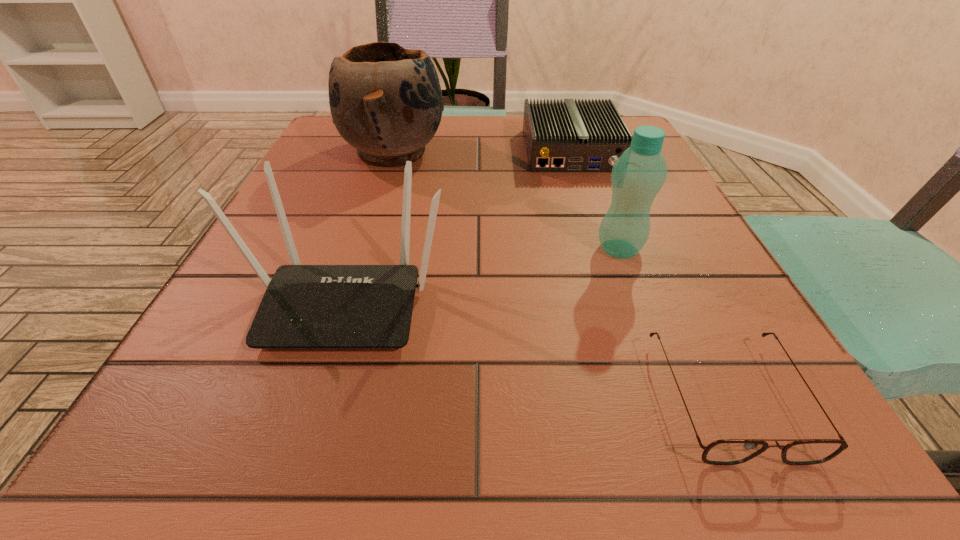
This screenshot has width=960, height=540. In order to click on vacant space located 0.280m on the back panel of the farther router in this screenshot , I will do `click(610, 265)`.

This screenshot has height=540, width=960. What are the coordinates of `pottery that is at the far edge` in the screenshot? It's located at (386, 101).

Find the location of `router present at the far edge`. router present at the far edge is located at coordinates (568, 136).

The height and width of the screenshot is (540, 960). I want to click on object that is at the near edge, so click(725, 451).

Identify the location of pottery that is at the left edge. This screenshot has height=540, width=960. (386, 101).

Where is `router situated at the left edge`? This screenshot has width=960, height=540. router situated at the left edge is located at coordinates (304, 306).

You are a GUI agent. You are given a task and a screenshot of the screen. Output one action in this format:
    pyautogui.click(x=<x>, y=<y>)
    Task: Click on the bottle that is at the right edge
    Image resolution: width=960 pixels, height=540 pixels.
    Given the screenshot: What is the action you would take?
    pyautogui.click(x=637, y=176)

Find the location of a particular element. The height and width of the screenshot is (540, 960). router present at the right edge is located at coordinates (568, 136).

Where is `sunglasses that is positioned at the right edge`? Image resolution: width=960 pixels, height=540 pixels. sunglasses that is positioned at the right edge is located at coordinates (725, 451).

At what (x,y) coordinates should I click in order to perform the action: click on object that is at the far left corner. Please return your answer as a coordinate pair (x, y). The width and height of the screenshot is (960, 540). Looking at the image, I should click on (x=386, y=101).